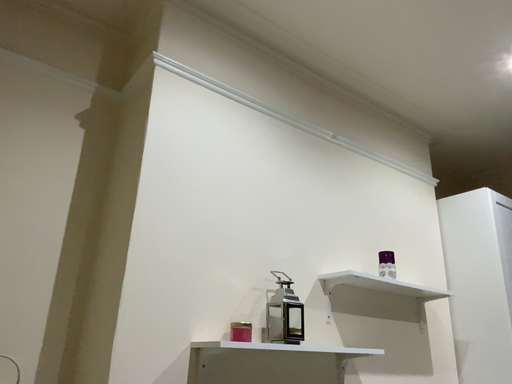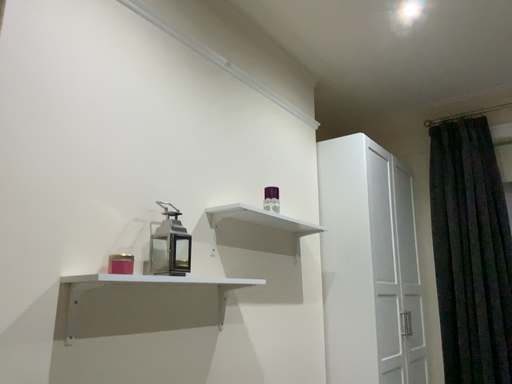
Question: Which way did the camera rotate in the video?

Choices:
 (A) rotated upward
 (B) rotated downward

Answer: (B)